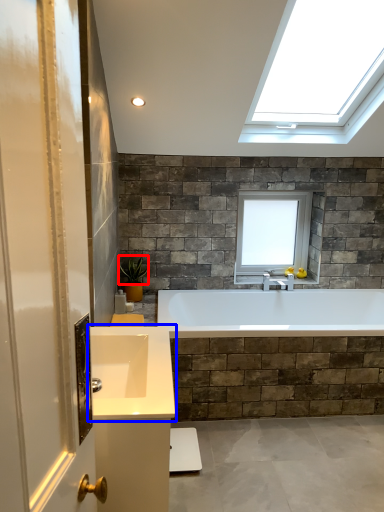
Question: Among these objects, which one is farthest to the camera, plant (highlighted by a red box) or sink (highlighted by a blue box)?

Choices:
 (A) plant
 (B) sink

Answer: (A)